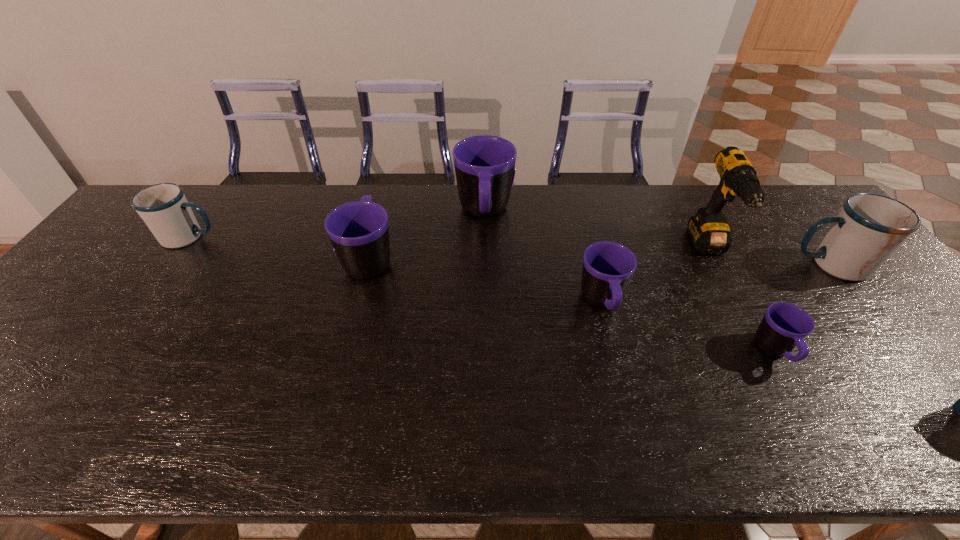
The image size is (960, 540). Identify the location of the third biggest black mug. (608, 267).

At what (x,y) coordinates should I click in order to perform the action: click on the fourth object from left to right. Please return your answer as a coordinate pair (x, y). This screenshot has width=960, height=540. Looking at the image, I should click on (608, 267).

Identify the location of the shortest mug. This screenshot has height=540, width=960. (784, 326).

Locate an element on the screen. the shortest object is located at coordinates (784, 326).

Image resolution: width=960 pixels, height=540 pixels. In order to click on free space located at the tip of the black drill in this screenshot , I will do `click(754, 329)`.

You are a GUI agent. You are given a task and a screenshot of the screen. Output one action in this format:
    pyautogui.click(x=<x>, y=<y>)
    Task: Click on the free spot located with the handle on the side of the fifth object from right to left
    
    Given the screenshot: What is the action you would take?
    pyautogui.click(x=485, y=265)

This screenshot has width=960, height=540. In order to click on vacant space located on the handle side of the right white mug in this screenshot , I will do [x=682, y=265].

This screenshot has width=960, height=540. In order to click on vacant space situated on the handle side of the right white mug in this screenshot , I will do `click(696, 265)`.

At what (x,y) coordinates should I click in order to perform the action: click on free space located 0.260m on the handle side of the right white mug. Please return your answer as a coordinate pair (x, y). The image size is (960, 540). Looking at the image, I should click on 700,265.

Locate an element on the screen. Image resolution: width=960 pixels, height=540 pixels. vacant space located 0.090m with the handle on the side of the second biggest black mug is located at coordinates (381, 216).